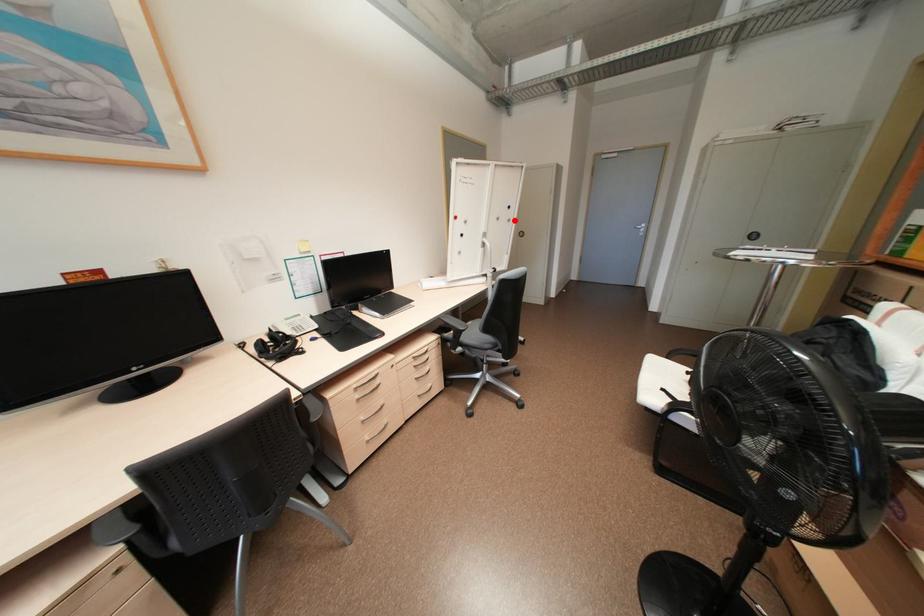
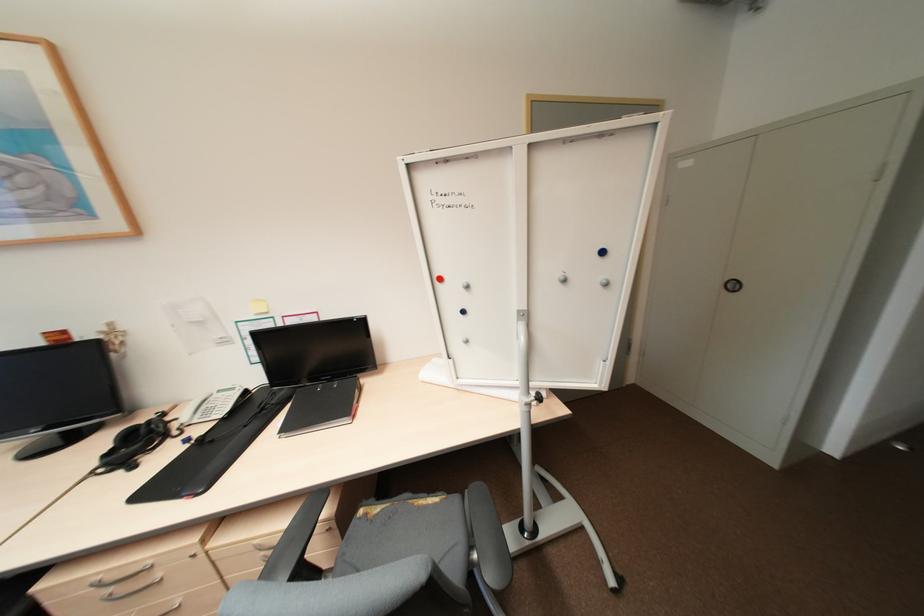
Question: A red point is marked in image1. In image2, is the corresponding 3D point closer to the camera or farther? Reply with the corresponding letter.

Choices:
 (A) The corresponding 3D point is closer.
 (B) The corresponding 3D point is farther.

Answer: (B)